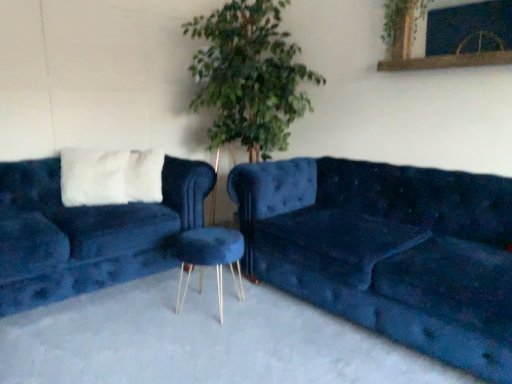
This screenshot has height=384, width=512. I want to click on free point above velvet blue stool at center (from a real-world perspective), so click(209, 231).